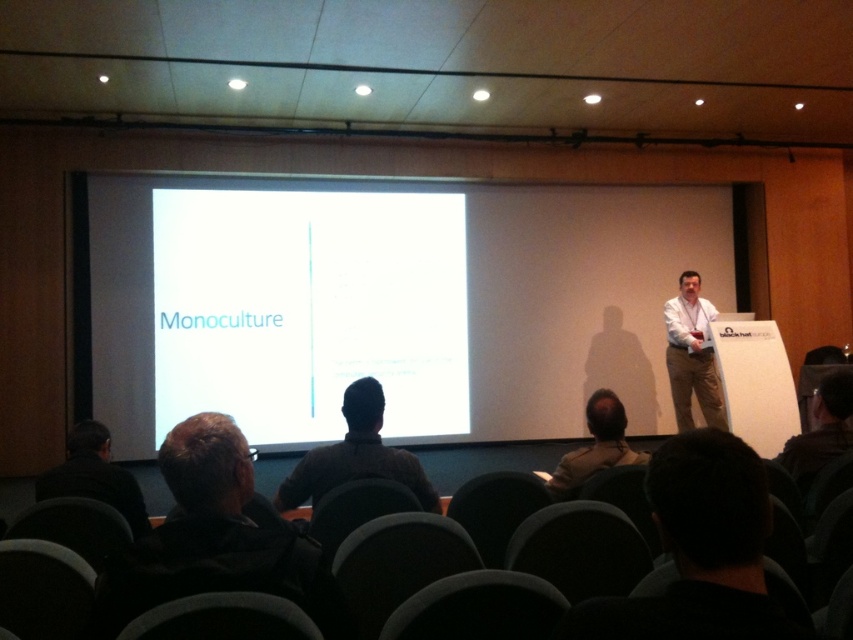
Question: Which point appears farthest from the camera in this image?

Choices:
 (A) click(589, 408)
 (B) click(671, 378)

Answer: (B)

Question: Is white matte projection screen at center thinner than brown leather jacket at lower center?

Choices:
 (A) yes
 (B) no

Answer: (B)

Question: Estimate the real-world distances between objects in this image. Which object is farther from the dark gray jacket at lower left?

Choices:
 (A) dark brown sweater at center
 (B) dark gray shirt at lower left
 (C) khaki cotton pants at right

Answer: (C)

Question: Does dark brown sweater at center have a smaller size compared to khaki cotton pants at right?

Choices:
 (A) no
 (B) yes

Answer: (B)

Question: Does white matte projection screen at center have a greater width compared to dark brown sweater at center?

Choices:
 (A) no
 (B) yes

Answer: (B)

Question: Which point is closer to the camera taking this photo?

Choices:
 (A) (595, 412)
 (B) (689, 396)
 (C) (103, 484)

Answer: (C)